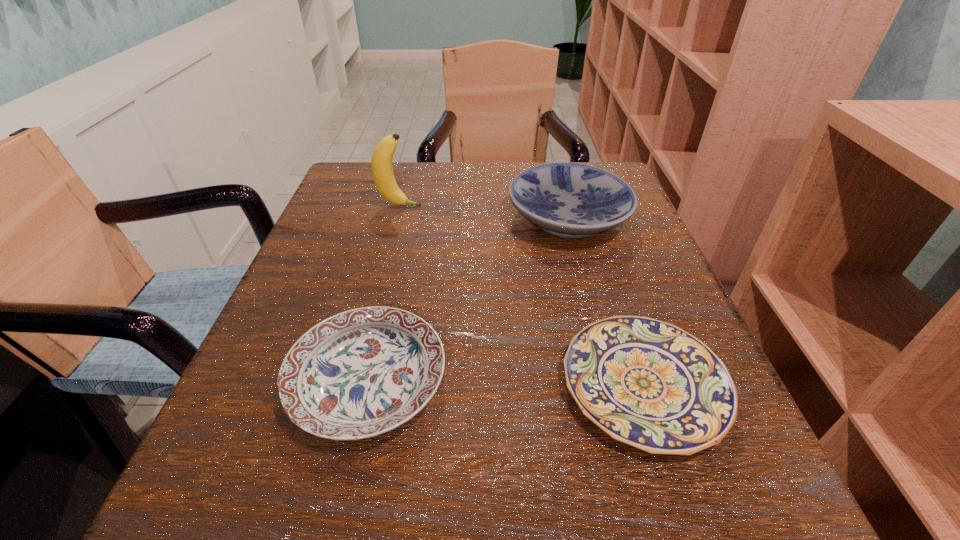
This screenshot has height=540, width=960. Identify the location of vacant space at the right edge of the desktop. (587, 247).

Where is `vacant space at the far left corner`? Image resolution: width=960 pixels, height=540 pixels. vacant space at the far left corner is located at coordinates (411, 161).

This screenshot has height=540, width=960. Find the location of `free spot at the near right corner of the desktop`. free spot at the near right corner of the desktop is located at coordinates (660, 464).

This screenshot has height=540, width=960. Find the location of `free space between the farthest plate and the second shortest plate`. free space between the farthest plate and the second shortest plate is located at coordinates (468, 300).

Find the location of a particular element. This screenshot has width=960, height=540. vacant space that's between the tallest object and the second shortest object is located at coordinates (384, 293).

This screenshot has height=540, width=960. I want to click on free space between the shortest plate and the second shortest plate, so click(506, 383).

Identify the location of free spot between the third shortest object and the shortest object. The height and width of the screenshot is (540, 960). (606, 302).

Locate an element on the screen. free spot between the shortest plate and the banana is located at coordinates (521, 296).

The image size is (960, 540). Find the location of `vacant space that is in between the second tallest plate and the tallest object`. vacant space that is in between the second tallest plate and the tallest object is located at coordinates [384, 293].

The height and width of the screenshot is (540, 960). I want to click on free space between the second shortest plate and the tallest plate, so click(468, 300).